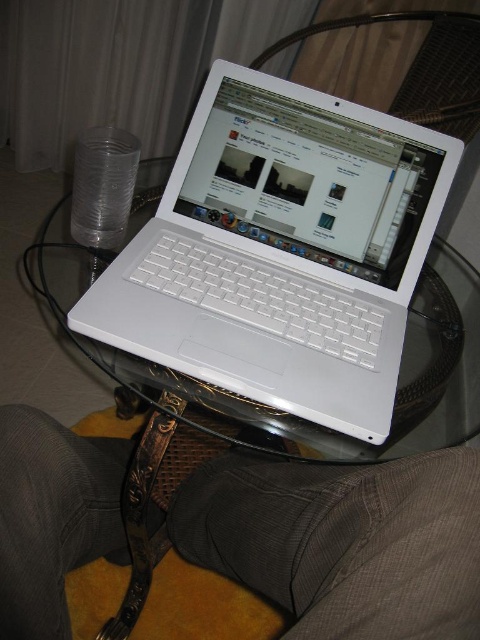
Does white glossy laptop at center appear over gray fabric pants at lower center?

Indeed, white glossy laptop at center is positioned over gray fabric pants at lower center.

Does white glossy laptop at center appear under gray fabric pants at lower center?

No, white glossy laptop at center is not below gray fabric pants at lower center.

Is point (224, 296) in front of point (120, 516)?

Yes, it is.

Locate an element on the screen. The image size is (480, 640). white glossy laptop at center is located at coordinates (282, 252).